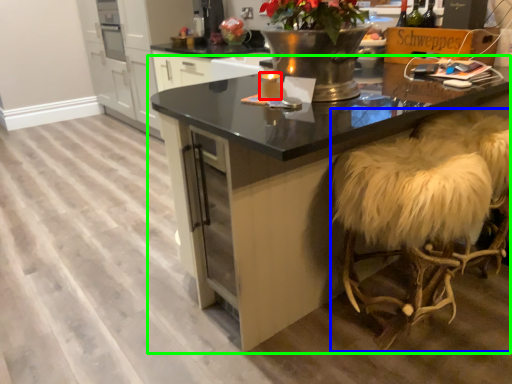
Question: Based on their relative distances, which object is nearer to candle (highlighted by a red box)? Choose from swivel chair (highlighted by a blue box) and table (highlighted by a green box).

Choices:
 (A) swivel chair
 (B) table

Answer: (B)